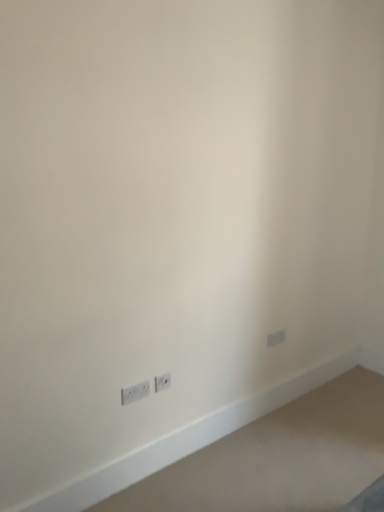
You are a GUI agent. You are given a task and a screenshot of the screen. Output one action in this format:
    pyautogui.click(x=<x>, y=<y>)
    Task: Click on the white plastic power plugs and sockets at lower left, acting as the 2th power plugs and sockets starting from the left
    The width and height of the screenshot is (384, 512).
    Given the screenshot: What is the action you would take?
    pyautogui.click(x=162, y=382)

Image resolution: width=384 pixels, height=512 pixels. What do you see at coordinates (162, 382) in the screenshot?
I see `white plastic power plugs and sockets at lower left, acting as the 2th power plugs and sockets starting from the left` at bounding box center [162, 382].

Where is `white plastic power plugs and sockets at lower left, placed as the second power plugs and sockets when sorted from right to left`? white plastic power plugs and sockets at lower left, placed as the second power plugs and sockets when sorted from right to left is located at coordinates [135, 392].

Describe the element at coordinates (135, 392) in the screenshot. I see `white plastic power plugs and sockets at lower left, which is the second power plugs and sockets from back to front` at that location.

I want to click on white plastic power plugs and sockets at lower left, marked as the 1th power plugs and sockets in a right-to-left arrangement, so point(162,382).

Does white plastic power plugs and sockets at lower left, the first power plugs and sockets when ordered from back to front, appear on the right side of white plastic power plugs and sockets at lower left, which is the second power plugs and sockets from back to front?

Yes.

Is the position of white plastic power plugs and sockets at lower left, acting as the 2th power plugs and sockets starting from the left, less distant than that of white plastic power plugs and sockets at lower left, placed as the second power plugs and sockets when sorted from right to left?

No, it is not.

Considering the points (169, 386) and (123, 398), which point is in front, point (169, 386) or point (123, 398)?

The point (123, 398) is in front.

From the image's perspective, is white plastic power plugs and sockets at lower left, marked as the 1th power plugs and sockets in a right-to-left arrangement, on white plastic power plugs and sockets at lower left, placed as the second power plugs and sockets when sorted from right to left?

Yes.

From a real-world perspective, is white plastic power plugs and sockets at lower left, acting as the 2th power plugs and sockets starting from the left, positioned under white plastic power plugs and sockets at lower left, placed as the second power plugs and sockets when sorted from right to left, based on gravity?

Actually, white plastic power plugs and sockets at lower left, acting as the 2th power plugs and sockets starting from the left, is physically above white plastic power plugs and sockets at lower left, placed as the second power plugs and sockets when sorted from right to left, in the real world.

In terms of width, does white plastic power plugs and sockets at lower left, marked as the 1th power plugs and sockets in a right-to-left arrangement, look wider or thinner when compared to white plastic power plugs and sockets at lower left, which is the second power plugs and sockets from back to front?

Clearly, white plastic power plugs and sockets at lower left, marked as the 1th power plugs and sockets in a right-to-left arrangement, has less width compared to white plastic power plugs and sockets at lower left, which is the second power plugs and sockets from back to front.

Is white plastic power plugs and sockets at lower left, placed as the 2th power plugs and sockets when sorted from front to back, shorter than white plastic power plugs and sockets at lower left, the first power plugs and sockets positioned from the front?

In fact, white plastic power plugs and sockets at lower left, placed as the 2th power plugs and sockets when sorted from front to back, may be taller than white plastic power plugs and sockets at lower left, the first power plugs and sockets positioned from the front.

In the scene shown: Can you confirm if white plastic power plugs and sockets at lower left, acting as the 2th power plugs and sockets starting from the left, is bigger than white plastic power plugs and sockets at lower left, the 1th power plugs and sockets in the left-to-right sequence?

No, white plastic power plugs and sockets at lower left, acting as the 2th power plugs and sockets starting from the left, is not bigger than white plastic power plugs and sockets at lower left, the 1th power plugs and sockets in the left-to-right sequence.

Is white plastic power plugs and sockets at lower left, placed as the 2th power plugs and sockets when sorted from front to back, positioned beyond the bounds of white plastic power plugs and sockets at lower left, the first power plugs and sockets positioned from the front?

Yes, white plastic power plugs and sockets at lower left, placed as the 2th power plugs and sockets when sorted from front to back, is outside of white plastic power plugs and sockets at lower left, the first power plugs and sockets positioned from the front.

Is white plastic power plugs and sockets at lower left, marked as the 1th power plugs and sockets in a right-to-left arrangement, next to white plastic power plugs and sockets at lower left, which is the second power plugs and sockets from back to front?

No, white plastic power plugs and sockets at lower left, marked as the 1th power plugs and sockets in a right-to-left arrangement, is not next to white plastic power plugs and sockets at lower left, which is the second power plugs and sockets from back to front.

Is white plastic power plugs and sockets at lower left, placed as the 2th power plugs and sockets when sorted from front to back, facing towards white plastic power plugs and sockets at lower left, which is the second power plugs and sockets from back to front?

No, white plastic power plugs and sockets at lower left, placed as the 2th power plugs and sockets when sorted from front to back, is not oriented towards white plastic power plugs and sockets at lower left, which is the second power plugs and sockets from back to front.

What's the angular difference between white plastic power plugs and sockets at lower left, acting as the 2th power plugs and sockets starting from the left, and white plastic power plugs and sockets at lower left, the 1th power plugs and sockets in the left-to-right sequence,'s facing directions?

4.48 degrees separate the facing orientations of white plastic power plugs and sockets at lower left, acting as the 2th power plugs and sockets starting from the left, and white plastic power plugs and sockets at lower left, the 1th power plugs and sockets in the left-to-right sequence.

The image size is (384, 512). Identify the location of power plugs and sockets positioned vertically above the white plastic power plugs and sockets at lower left, placed as the second power plugs and sockets when sorted from right to left (from a real-world perspective). (162, 382).

Between white plastic power plugs and sockets at lower left, which is the second power plugs and sockets from back to front, and white plastic power plugs and sockets at lower left, marked as the 1th power plugs and sockets in a right-to-left arrangement, which one appears on the left side from the viewer's perspective?

From the viewer's perspective, white plastic power plugs and sockets at lower left, which is the second power plugs and sockets from back to front, appears more on the left side.

Between white plastic power plugs and sockets at lower left, which is the second power plugs and sockets from back to front, and white plastic power plugs and sockets at lower left, acting as the 2th power plugs and sockets starting from the left, which one is positioned behind?

white plastic power plugs and sockets at lower left, acting as the 2th power plugs and sockets starting from the left, is further away from the camera.

Is point (140, 389) closer or farther from the camera than point (156, 384)?

Point (140, 389) appears to be closer to the viewer than point (156, 384).

From the image's perspective, between white plastic power plugs and sockets at lower left, the 1th power plugs and sockets in the left-to-right sequence, and white plastic power plugs and sockets at lower left, placed as the 2th power plugs and sockets when sorted from front to back, which one is located above?

white plastic power plugs and sockets at lower left, placed as the 2th power plugs and sockets when sorted from front to back, is shown above in the image.

From a real-world perspective, between white plastic power plugs and sockets at lower left, the 1th power plugs and sockets in the left-to-right sequence, and white plastic power plugs and sockets at lower left, placed as the 2th power plugs and sockets when sorted from front to back, who is vertically higher?

white plastic power plugs and sockets at lower left, placed as the 2th power plugs and sockets when sorted from front to back, is physically above.

Can you confirm if white plastic power plugs and sockets at lower left, placed as the second power plugs and sockets when sorted from right to left, is thinner than white plastic power plugs and sockets at lower left, acting as the 2th power plugs and sockets starting from the left?

Incorrect, the width of white plastic power plugs and sockets at lower left, placed as the second power plugs and sockets when sorted from right to left, is not less than that of white plastic power plugs and sockets at lower left, acting as the 2th power plugs and sockets starting from the left.

Considering the sizes of objects white plastic power plugs and sockets at lower left, the 1th power plugs and sockets in the left-to-right sequence, and white plastic power plugs and sockets at lower left, the first power plugs and sockets when ordered from back to front, in the image provided, who is taller, white plastic power plugs and sockets at lower left, the 1th power plugs and sockets in the left-to-right sequence, or white plastic power plugs and sockets at lower left, the first power plugs and sockets when ordered from back to front,?

Standing taller between the two is white plastic power plugs and sockets at lower left, the first power plugs and sockets when ordered from back to front.

Which of these two, white plastic power plugs and sockets at lower left, the 1th power plugs and sockets in the left-to-right sequence, or white plastic power plugs and sockets at lower left, placed as the 2th power plugs and sockets when sorted from front to back, is smaller?

white plastic power plugs and sockets at lower left, placed as the 2th power plugs and sockets when sorted from front to back, is smaller.

Is white plastic power plugs and sockets at lower left, the first power plugs and sockets positioned from the front, outside of white plastic power plugs and sockets at lower left, marked as the 1th power plugs and sockets in a right-to-left arrangement?

A: white plastic power plugs and sockets at lower left, the first power plugs and sockets positioned from the front, lies outside white plastic power plugs and sockets at lower left, marked as the 1th power plugs and sockets in a right-to-left arrangement,'s area.

Are white plastic power plugs and sockets at lower left, which is the second power plugs and sockets from back to front, and white plastic power plugs and sockets at lower left, marked as the 1th power plugs and sockets in a right-to-left arrangement, far apart?

No, there isn't a large distance between white plastic power plugs and sockets at lower left, which is the second power plugs and sockets from back to front, and white plastic power plugs and sockets at lower left, marked as the 1th power plugs and sockets in a right-to-left arrangement.

Could you tell me if white plastic power plugs and sockets at lower left, the 1th power plugs and sockets in the left-to-right sequence, is facing white plastic power plugs and sockets at lower left, marked as the 1th power plugs and sockets in a right-to-left arrangement?

No, white plastic power plugs and sockets at lower left, the 1th power plugs and sockets in the left-to-right sequence, is not aimed at white plastic power plugs and sockets at lower left, marked as the 1th power plugs and sockets in a right-to-left arrangement.

What are the coordinates of `power plugs and sockets that appears above the white plastic power plugs and sockets at lower left, the 1th power plugs and sockets in the left-to-right sequence (from a real-world perspective)` in the screenshot? It's located at pyautogui.click(x=162, y=382).

At what (x,y) coordinates should I click in order to perform the action: click on power plugs and sockets below the white plastic power plugs and sockets at lower left, acting as the 2th power plugs and sockets starting from the left (from the image's perspective). Please return your answer as a coordinate pair (x, y). Image resolution: width=384 pixels, height=512 pixels. Looking at the image, I should click on (135, 392).

Image resolution: width=384 pixels, height=512 pixels. I want to click on power plugs and sockets on the left of white plastic power plugs and sockets at lower left, acting as the 2th power plugs and sockets starting from the left, so click(x=135, y=392).